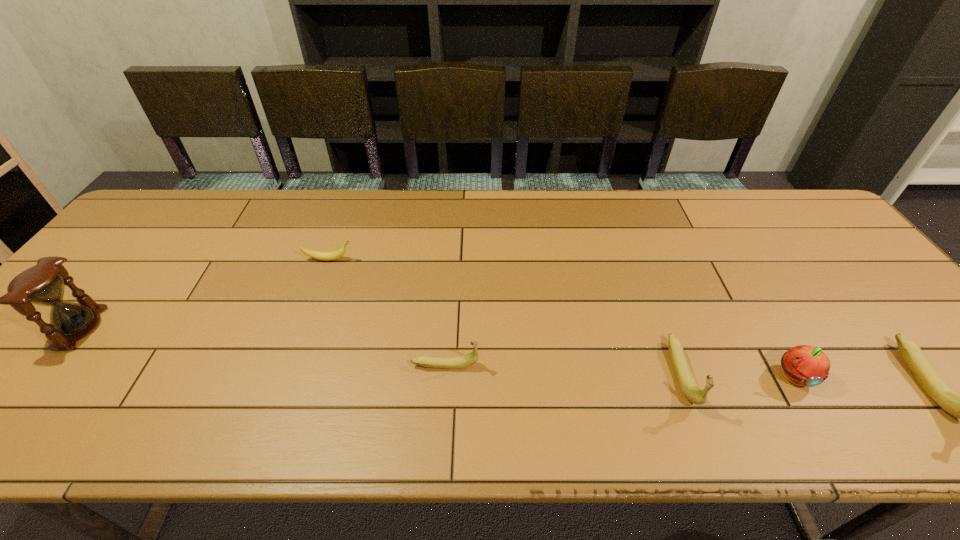
Image resolution: width=960 pixels, height=540 pixels. In order to click on vacant region that satisfies the following two spatial constraints: 1. at the stem of the leftmost banana; 2. on the front side of the hourglass in this screenshot , I will do `click(304, 328)`.

Where is `vacant area that satisfies the following two spatial constraints: 1. at the stem of the apple; 2. on the left side of the second banana from right to left`? The height and width of the screenshot is (540, 960). vacant area that satisfies the following two spatial constraints: 1. at the stem of the apple; 2. on the left side of the second banana from right to left is located at coordinates (682, 376).

Where is `free location that satisfies the following two spatial constraints: 1. at the stem of the third banana from right to left; 2. on the right side of the second object from right to left`? The image size is (960, 540). free location that satisfies the following two spatial constraints: 1. at the stem of the third banana from right to left; 2. on the right side of the second object from right to left is located at coordinates (444, 376).

Locate an element on the screen. The height and width of the screenshot is (540, 960). vacant region that satisfies the following two spatial constraints: 1. at the stem of the fifth object from left to right; 2. on the left side of the leftmost banana is located at coordinates (288, 376).

Image resolution: width=960 pixels, height=540 pixels. I want to click on vacant space that satisfies the following two spatial constraints: 1. at the stem of the fourth object from right to left; 2. on the right side of the apple, so click(444, 376).